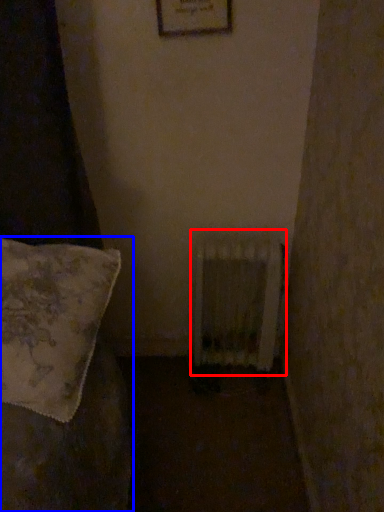
Question: Which object appears farthest to the camera in this image, radiator (highlighted by a red box) or furniture (highlighted by a blue box)?

Choices:
 (A) radiator
 (B) furniture

Answer: (A)